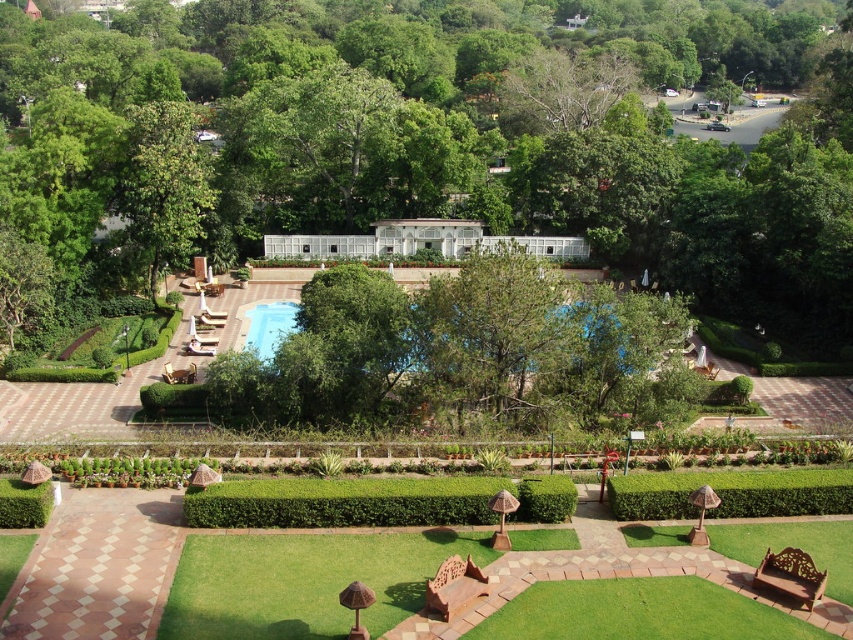
Question: Observing the image, what is the correct spatial positioning of green leafy hedge at center in reference to transparent glass pool at center?

Choices:
 (A) left
 (B) right

Answer: (B)

Question: Is green leafy tree at upper left behind transparent glass pool at center?

Choices:
 (A) no
 (B) yes

Answer: (B)

Question: Estimate the real-world distances between objects in this image. Which object is closer to the green leafy hedge at center?

Choices:
 (A) transparent glass pool at center
 (B) green leafy tree at upper left
 (C) green leafy tree at center

Answer: (A)

Question: Which of the following is the closest to the observer?

Choices:
 (A) transparent glass pool at center
 (B) green leafy hedge at center
 (C) green leafy tree at upper left

Answer: (B)

Question: Which object appears farthest from the camera in this image?

Choices:
 (A) green leafy tree at upper left
 (B) green leafy tree at center
 (C) transparent glass pool at center
 (D) green leafy hedge at center

Answer: (A)

Question: Observing the image, what is the correct spatial positioning of green leafy tree at center in reference to green leafy hedge at center?

Choices:
 (A) below
 (B) above

Answer: (B)